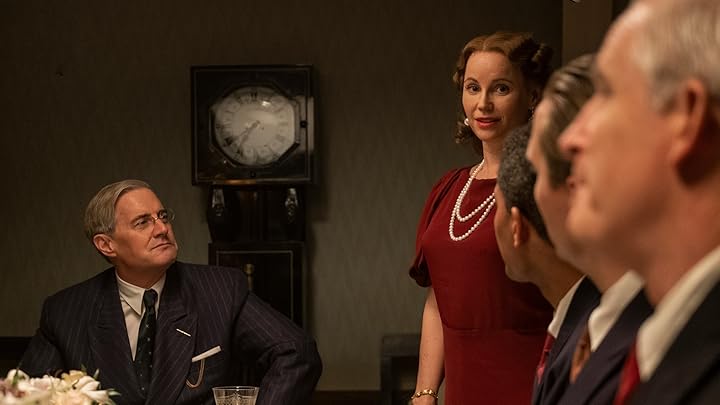
Where is `grandfather clock`? grandfather clock is located at coordinates (265, 103).